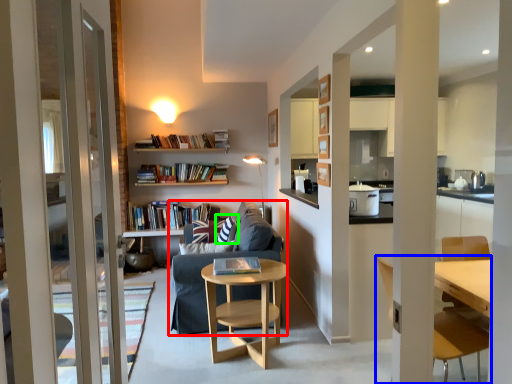
Question: Which is farther away from studio couch (highlighted by a red box)? chair (highlighted by a blue box) or pillow (highlighted by a green box)?

Choices:
 (A) chair
 (B) pillow

Answer: (A)